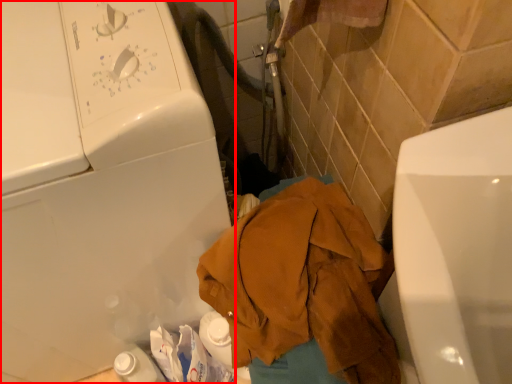
Question: Where is washing machine (annotated by the red box) located in relation to clothing in the image?

Choices:
 (A) left
 (B) right

Answer: (A)